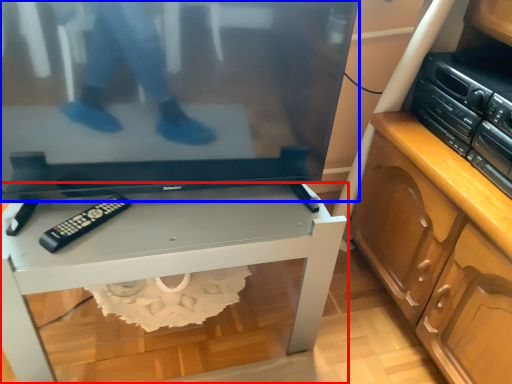
Question: Which of the following is the closest to the observer, desk (highlighted by a red box) or television (highlighted by a blue box)?

Choices:
 (A) desk
 (B) television

Answer: (B)